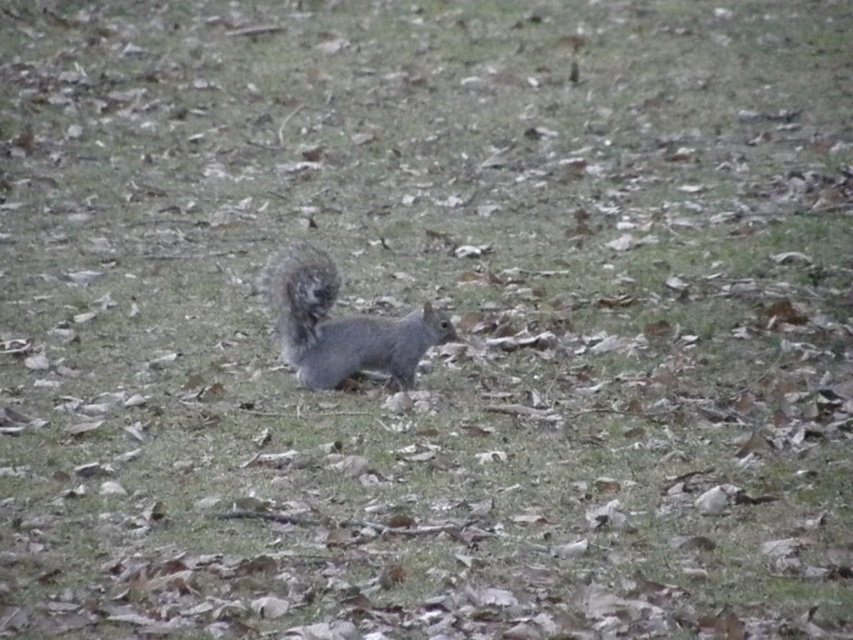
Does fuzzy gray squirrel at center appear on the left side of fuzzy gray tail at center?

Correct, you'll find fuzzy gray squirrel at center to the left of fuzzy gray tail at center.

In the scene shown: Measure the distance from fuzzy gray squirrel at center to fuzzy gray tail at center.

A distance of 17.04 centimeters exists between fuzzy gray squirrel at center and fuzzy gray tail at center.

Is point (300, 332) farther from camera compared to point (311, 276)?

Yes.

Identify the location of fuzzy gray squirrel at center. (340, 324).